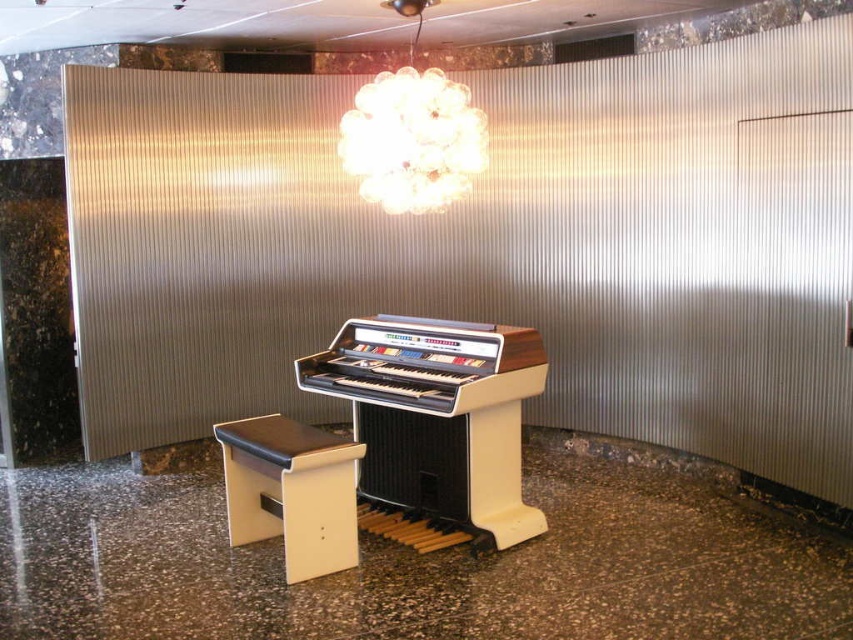
You are a guest in this room and want to sit on the beige leather music stool at center to play the organ. Before you move, you notice the translucent glass globe at upper center. Where is the glass globe located relative to the music stool?

The translucent glass globe at upper center is located to the right of the beige leather music stool at center.

You are a musician preparing to play the vintage organ. You need to adjust your position so that you can comfortably reach both the translucent glass globe at upper center and the beige leather music stool at center. Given that your arm span is 5.5 feet, will you be able to reach both items without moving your position?

The distance between the translucent glass globe at upper center and the beige leather music stool at center is 6.07 feet, which is greater than your arm span of 5.5 feet. Therefore, you cannot reach both items simultaneously without moving your position.